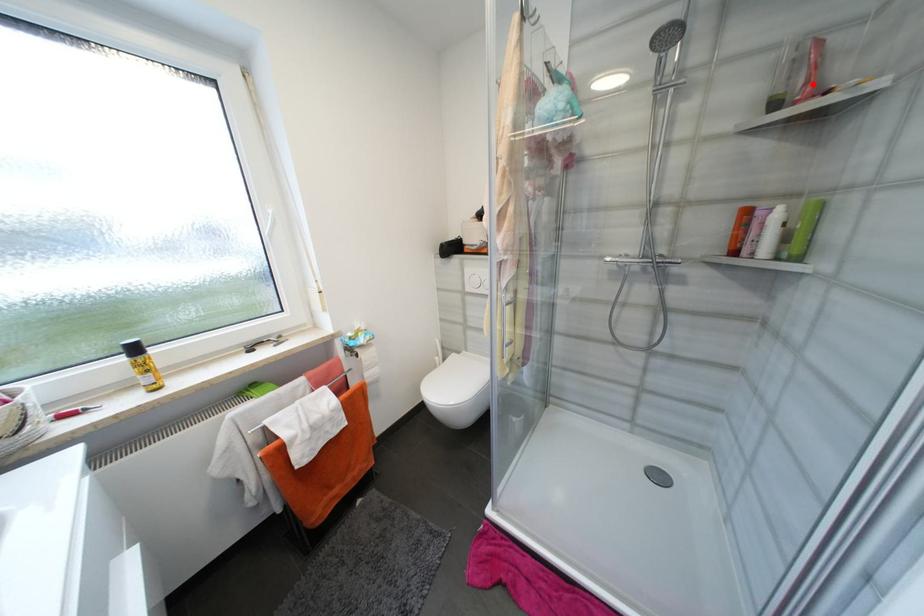
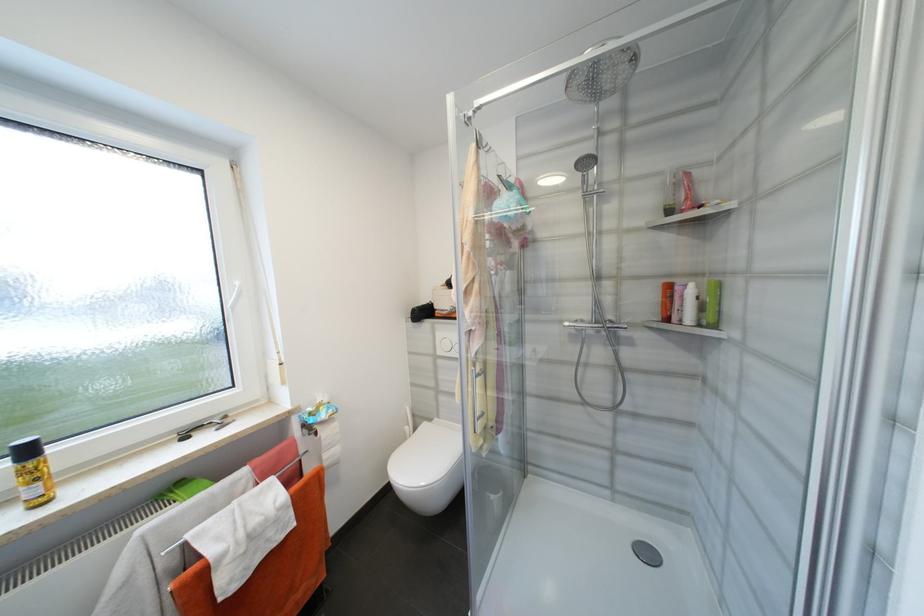
Question: I am providing you with two images of the same scene from different viewpoints. In image1, a red point is highlighted. Considering the same 3D point in image2, which of the following is correct?

Choices:
 (A) It is closer
 (B) It is farther

Answer: (A)